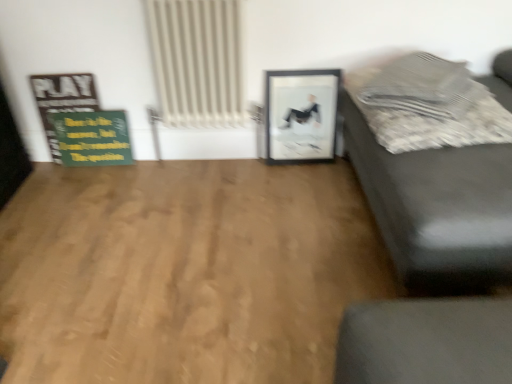
Question: From a real-world perspective, is textured gray pillow at upper right physically located above or below natural wood floor at center?

Choices:
 (A) below
 (B) above

Answer: (B)

Question: From the image's perspective, relative to natural wood floor at center, is textured gray pillow at upper right above or below?

Choices:
 (A) below
 (B) above

Answer: (B)

Question: Estimate the real-world distances between objects in this image. Which object is farther from the wooden signboard at left?

Choices:
 (A) white textured radiator at upper center
 (B) natural wood floor at center
 (C) matte black couch at right
 (D) textured gray pillow at upper right
 (E) black matte picture frame at center

Answer: (C)

Question: Which object is positioned closest to the textured gray pillow at upper right?

Choices:
 (A) white textured radiator at upper center
 (B) wooden signboard at left
 (C) natural wood floor at center
 (D) matte black couch at right
 (E) black matte picture frame at center

Answer: (D)